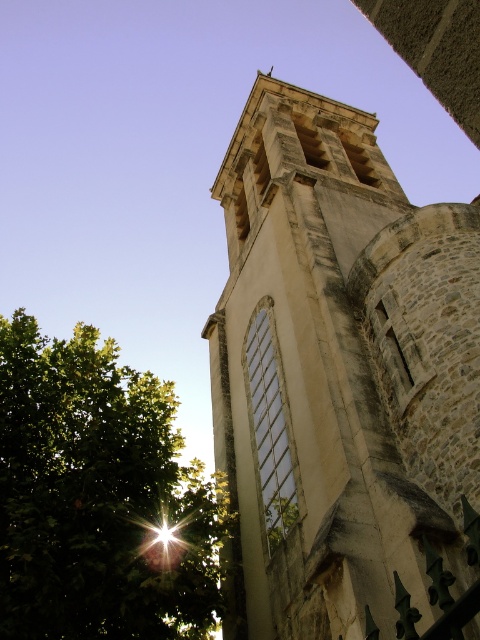
You are an architect analyzing the image. You need to determine the spatial relationship between the stone tower at center and the green leafy tree at lower left. Based on the scene, which object is placed higher in the image?

The stone tower at center is positioned over the green leafy tree at lower left, meaning it is higher in the image.

You are standing in front of the historic stone tower at center. You notice a specific point marked at coordinates point (338,372). Based on the scene description, can you determine if this point is located on the tower or somewhere else?

The point (338,372) is on the stone tower at center, as stated in the objects description.